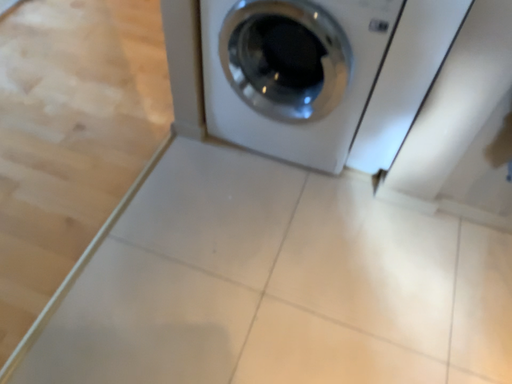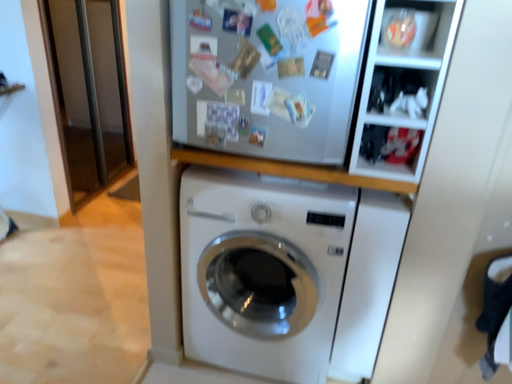
Question: How did the camera likely rotate when shooting the video?

Choices:
 (A) rotated downward
 (B) rotated upward

Answer: (B)